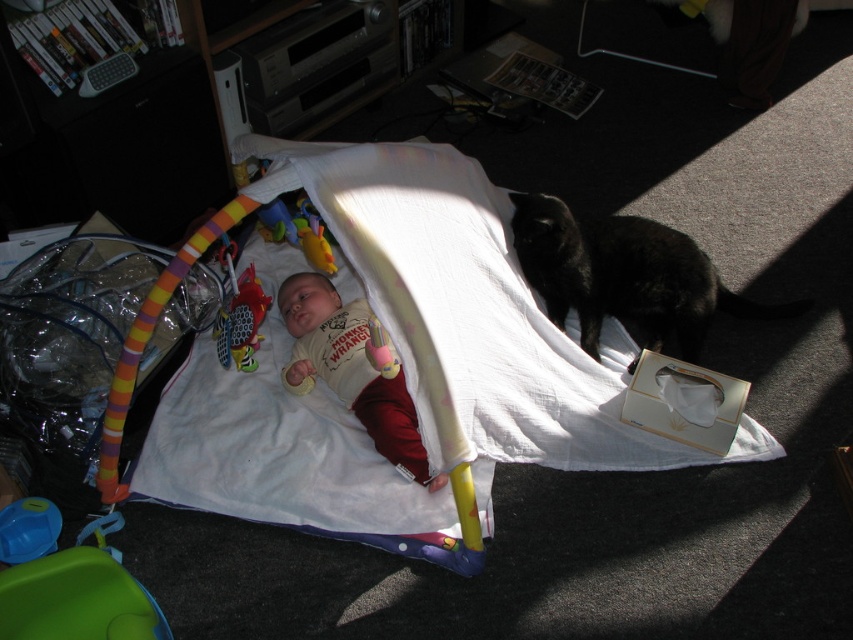
Which is behind, point (167, 438) or point (416, 436)?

Positioned behind is point (167, 438).

Between white soft fabric at center and white soft baby at center, which one is positioned higher?

Positioned higher is white soft fabric at center.

What do you see at coordinates (473, 316) in the screenshot?
I see `white soft fabric at center` at bounding box center [473, 316].

Identify the location of white soft fabric at center. (473, 316).

Measure the distance between white soft fabric at center and rubberized plastic toy at center.

A distance of 37.91 centimeters exists between white soft fabric at center and rubberized plastic toy at center.

In the scene shown: Can you confirm if white soft fabric at center is positioned above rubberized plastic toy at center?

No.

What do you see at coordinates (473, 316) in the screenshot? The image size is (853, 640). I see `white soft fabric at center` at bounding box center [473, 316].

You are a GUI agent. You are given a task and a screenshot of the screen. Output one action in this format:
    pyautogui.click(x=<x>, y=<y>)
    Task: Click on the white soft fabric at center
    The width and height of the screenshot is (853, 640).
    Given the screenshot: What is the action you would take?
    pyautogui.click(x=473, y=316)

Is point (251, 289) closer to viewer compared to point (32, 532)?

That is False.

This screenshot has height=640, width=853. Describe the element at coordinates (241, 321) in the screenshot. I see `rubberized plastic toy at center` at that location.

Is point (244, 273) less distant than point (22, 541)?

No.

Locate an element on the screen. The image size is (853, 640). rubberized plastic toy at center is located at coordinates (241, 321).